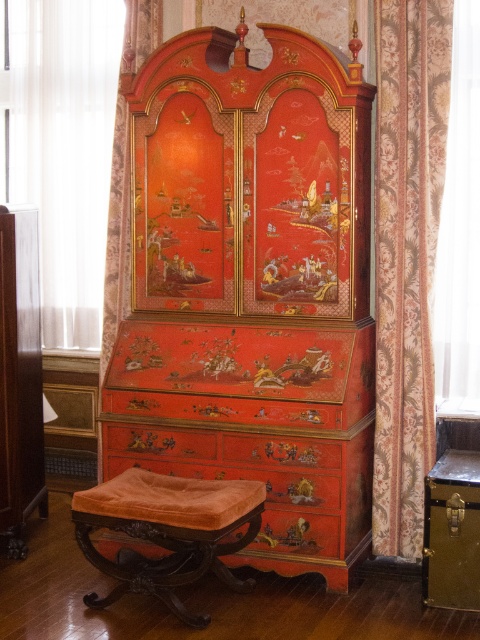
You are standing in the room and want to move from the floral fabric curtain at right to the matte lacquered cabinet at left. Which direction should you move?

You should move to the left because the floral fabric curtain at right is to the right of the matte lacquered cabinet at left, so moving left will take you towards the cabinet.

You are an interior designer who wants to place a new lamp on the floor between the floral fabric curtain at right and the velvet orange stool at lower center. Can you place it directly in the middle of the two objects?

The floral fabric curtain at right is located above the velvet orange stool at lower center, so placing a lamp directly between them on the floor would be possible as the curtain is above and not blocking the space between them.